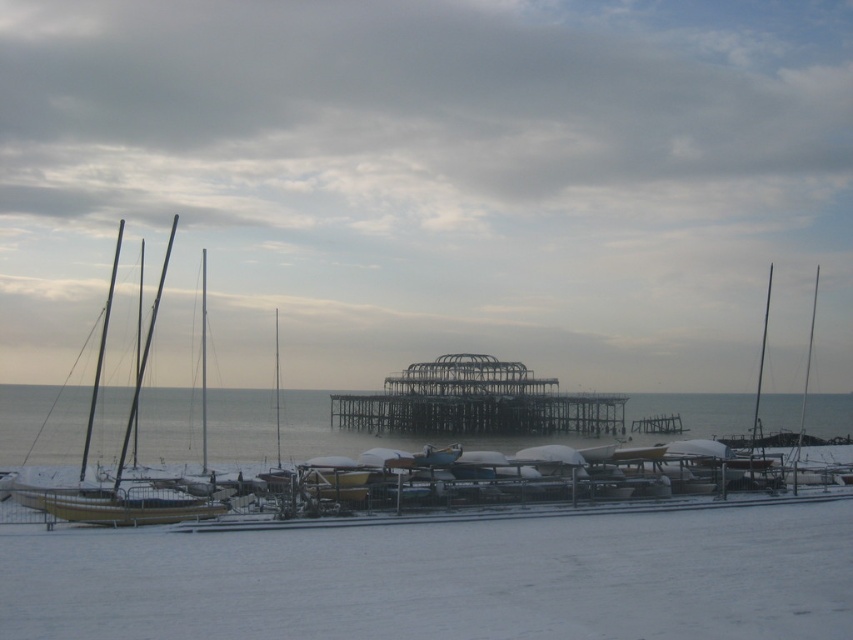
Is white matte snow at center closer to the viewer compared to wooden sailboat at left?

Yes, it is.

Between white matte snow at center and wooden sailboat at left, which one appears on the right side from the viewer's perspective?

From the viewer's perspective, white matte snow at center appears more on the right side.

Is point (305, 540) closer to viewer compared to point (103, 502)?

Yes, it is.

Find the location of a particular element. Image resolution: width=853 pixels, height=640 pixels. white matte snow at center is located at coordinates (444, 579).

Who is positioned more to the right, clear water at center or wooden sailboat at left?

From the viewer's perspective, clear water at center appears more on the right side.

Who is more forward, (78,452) or (129,428)?

Positioned in front is point (129,428).

Is point (318, 408) positioned in front of point (198, 508)?

No.

Find the location of a particular element. This screenshot has height=640, width=853. clear water at center is located at coordinates (370, 435).

Does metallic gray pier at center have a greater height compared to wooden sailboat at left?

Incorrect, metallic gray pier at center's height is not larger of wooden sailboat at left's.

Between point (618, 410) and point (65, 490), which one is positioned in front?

Point (65, 490) is in front.

Image resolution: width=853 pixels, height=640 pixels. Identify the location of metallic gray pier at center. (479, 413).